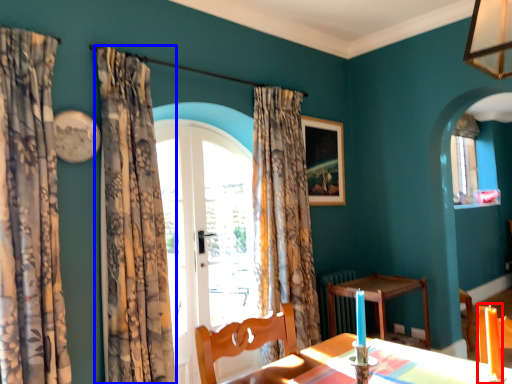
Question: Which object is closer to the camera taking this photo, candle (highlighted by a red box) or curtain (highlighted by a blue box)?

Choices:
 (A) candle
 (B) curtain

Answer: (A)